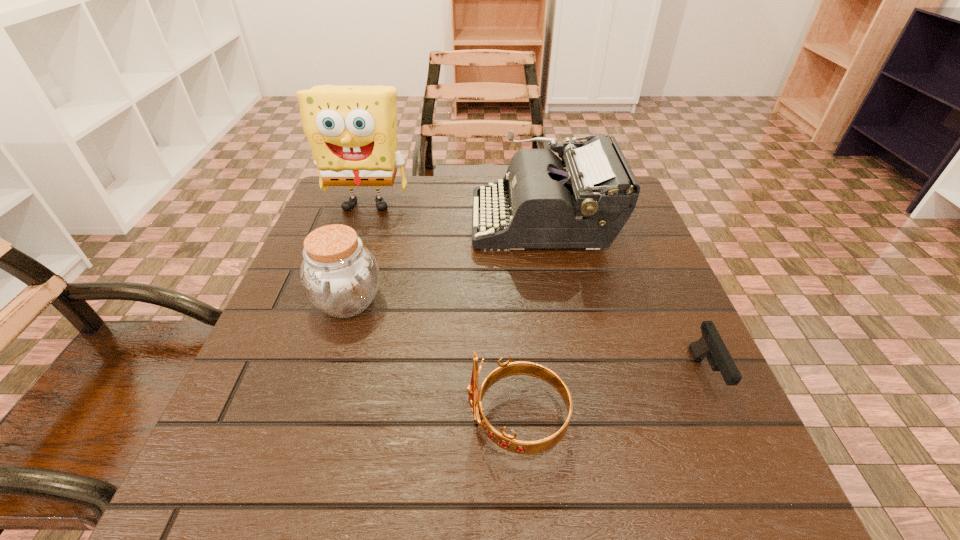
Select which object is the third closest to the tiara. Please provide its 2D coordinates. Your answer should be formatted as a tuple, i.e. [(x, y)], where the tuple contains the x and y coordinates of a point satisfying the conditions above.

[(584, 200)]

The width and height of the screenshot is (960, 540). Find the location of `vacant area that satisfies the following two spatial constraints: 1. on the front-facing side of the rightmost object; 2. on the front-facing side of the tiara`. vacant area that satisfies the following two spatial constraints: 1. on the front-facing side of the rightmost object; 2. on the front-facing side of the tiara is located at coordinates (725, 420).

At what (x,y) coordinates should I click in order to perform the action: click on vacant area that satisfies the following two spatial constraints: 1. on the face of the sponge; 2. on the left side of the third nearest object. Please return your answer as a coordinate pair (x, y). The width and height of the screenshot is (960, 540). Looking at the image, I should click on (333, 301).

This screenshot has height=540, width=960. In order to click on free space in the image that satisfies the following two spatial constraints: 1. on the front-facing side of the shortest object; 2. on the front-facing side of the tiara in this screenshot , I will do `click(725, 420)`.

This screenshot has width=960, height=540. I want to click on vacant position in the image that satisfies the following two spatial constraints: 1. on the face of the tallest object; 2. on the right side of the third farthest object, so click(333, 301).